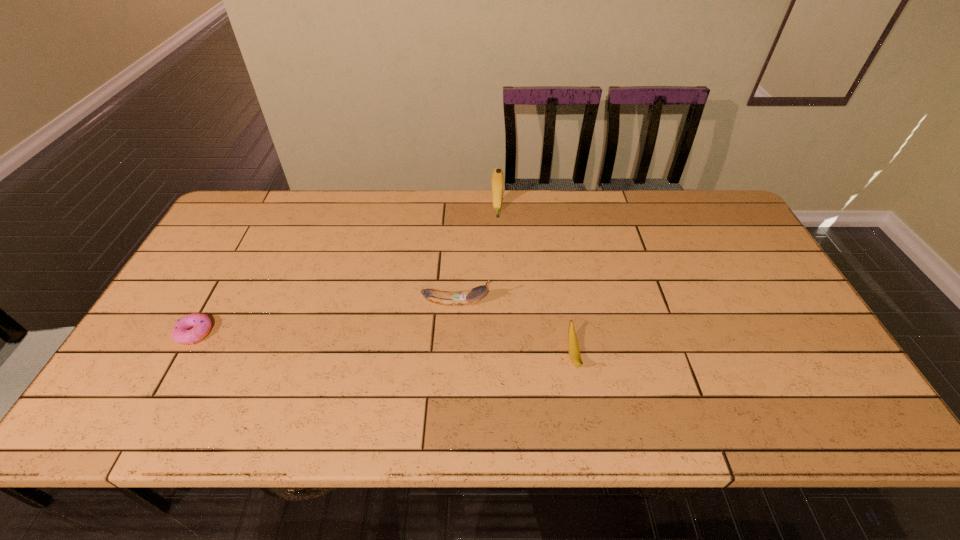
I want to click on vacant space situated 0.090m at the stem of the rightmost object, so click(x=585, y=418).

Find the location of a particular element. Image resolution: width=960 pixels, height=540 pixels. blank space located on the right of the doughnut is located at coordinates (264, 333).

Where is `object that is at the far edge`? Image resolution: width=960 pixels, height=540 pixels. object that is at the far edge is located at coordinates (497, 180).

At what (x,y) coordinates should I click in order to perform the action: click on object that is at the left edge. Please return your answer as a coordinate pair (x, y). Looking at the image, I should click on (182, 333).

In the image, there is a desktop. Where is `vacant region at the far edge`? vacant region at the far edge is located at coordinates (615, 211).

This screenshot has width=960, height=540. In the image, there is a desktop. Find the location of `free space at the near edge`. free space at the near edge is located at coordinates (195, 420).

The image size is (960, 540). Identify the location of free point at the left edge. click(x=146, y=390).

I want to click on vacant area at the right edge of the desktop, so click(x=780, y=336).

The width and height of the screenshot is (960, 540). I want to click on vacant space at the near left corner, so click(130, 418).

In the image, there is a desktop. At what (x,y) coordinates should I click in order to perform the action: click on vacant space at the far right corner. Please return your answer as a coordinate pair (x, y). Looking at the image, I should click on (682, 191).